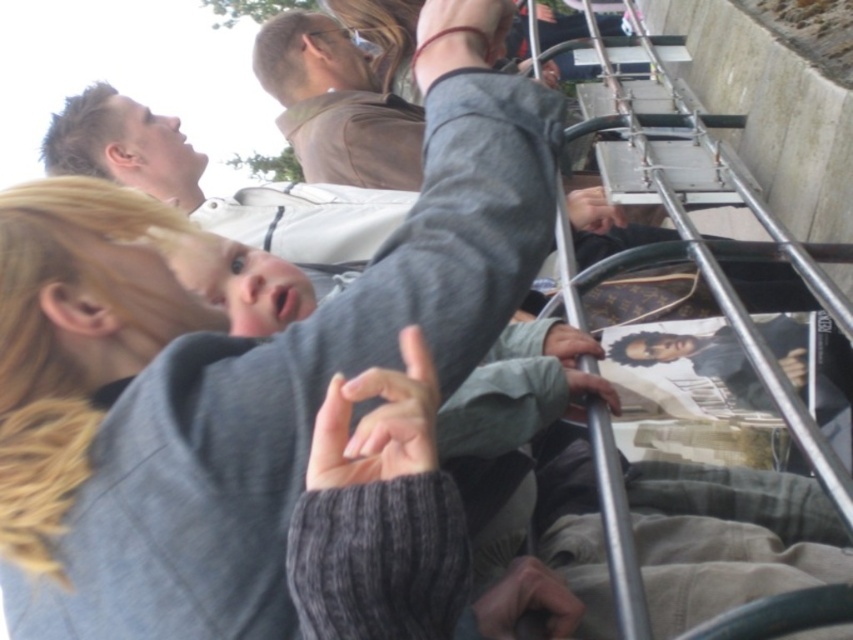
You are a passenger on a bus and see the gray knitted sweater at center and the matte gray hand at upper center. Which object is closer to you?

The gray knitted sweater at center is closer to you because it is in front of the matte gray hand at upper center.